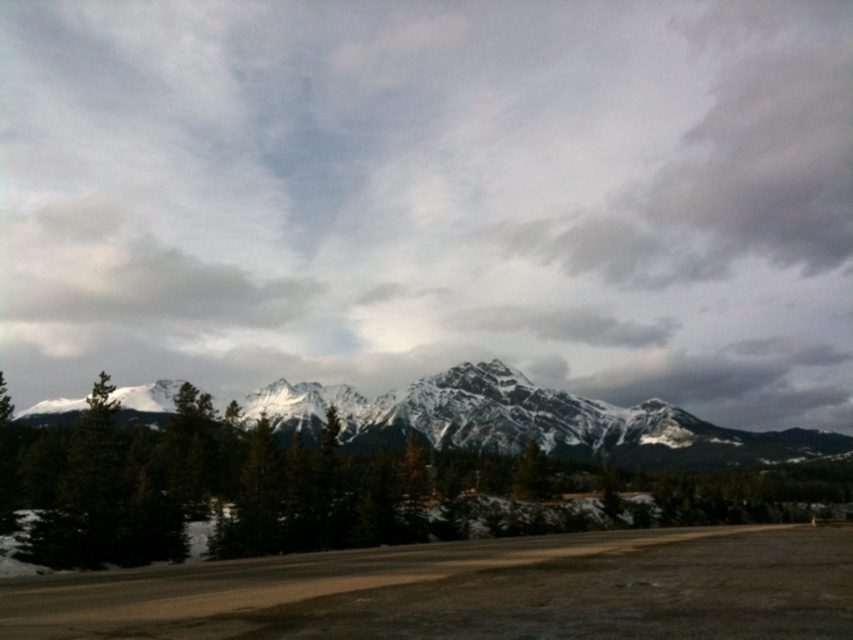
You are a hiker planning to walk from the green matte tree at left to the snowy granite mountains at center. Which direction should you head?

You should head to the right because the snowy granite mountains at center is located to the right of the green matte tree at left.

You are planning a hiking route and need to know the relative sizes of the snowy granite mountains at center and the green matte tree at left. Which one is wider?

The snowy granite mountains at center are wider than the green matte tree at left.

You are a hiker standing at the base of the mountain. You see the cloudy sky at upper center and the green matte tree at left. Which object is farther away from you?

The cloudy sky at upper center is farther away from you than the green matte tree at left because it is 317.56 meters away from the green matte tree at left.